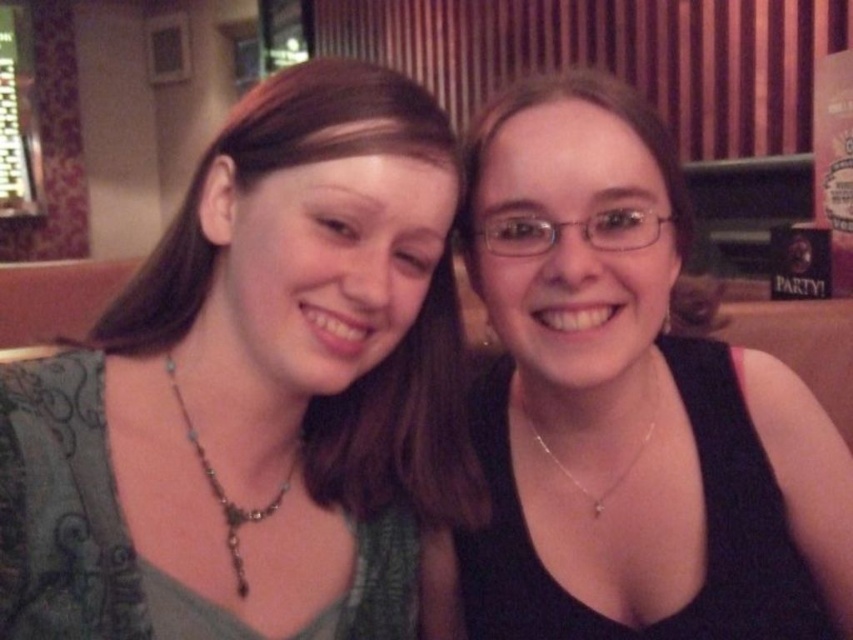
You are a GUI agent. You are given a task and a screenshot of the screen. Output one action in this format:
    pyautogui.click(x=<x>, y=<y>)
    Task: Click on the green fabric top at left
    The image size is (853, 640).
    Given the screenshot: What is the action you would take?
    pyautogui.click(x=256, y=392)

Which is in front, point (175, 563) or point (630, 470)?

Positioned in front is point (175, 563).

The width and height of the screenshot is (853, 640). What do you see at coordinates (256, 392) in the screenshot? I see `green fabric top at left` at bounding box center [256, 392].

Find the location of a particular element. The image size is (853, 640). green fabric top at left is located at coordinates click(256, 392).

Is black matte tank top at right to the left of silver beaded necklace at left from the viewer's perspective?

In fact, black matte tank top at right is to the right of silver beaded necklace at left.

Between black matte tank top at right and silver beaded necklace at left, which one has more height?

black matte tank top at right

Which is behind, point (535, 292) or point (195, 452)?

The point (535, 292) is more distant.

Locate an element on the screen. The image size is (853, 640). black matte tank top at right is located at coordinates (630, 404).

Which is in front, point (96, 504) or point (668, 547)?

Point (96, 504)

Can you confirm if green fabric top at left is positioned below black matte tank top at right?

No, green fabric top at left is not below black matte tank top at right.

Is point (216, 636) farther from camera compared to point (654, 358)?

No.

Identify the location of green fabric top at left. (256, 392).